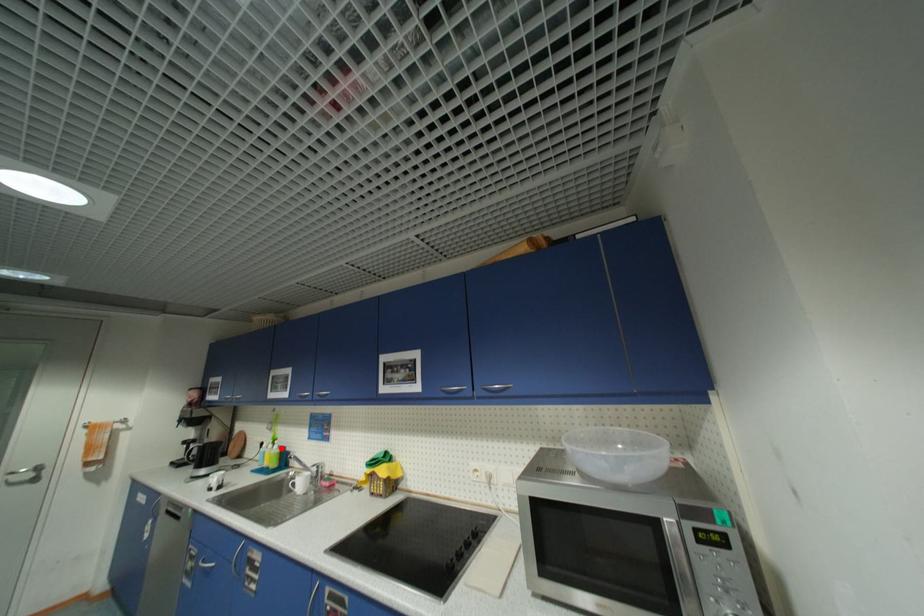
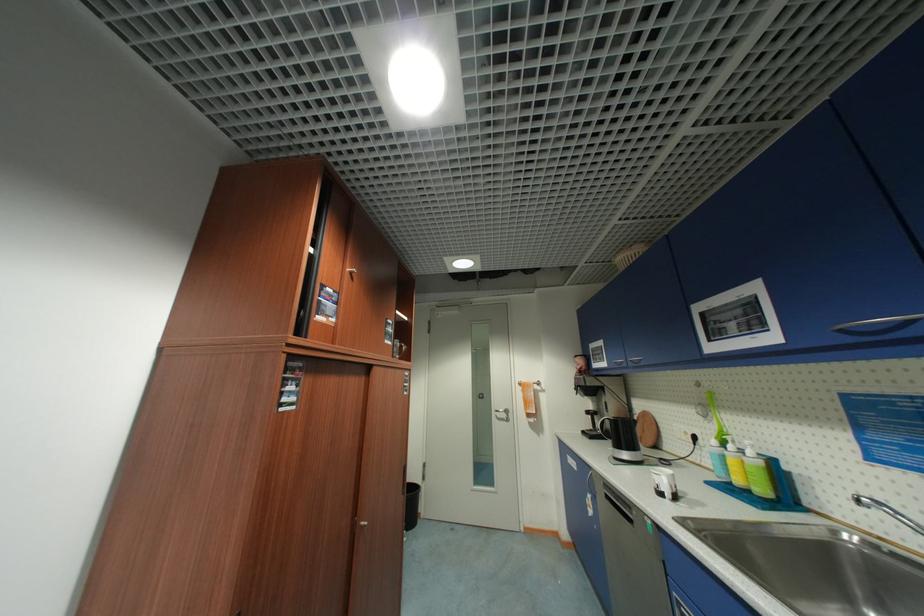
Find the pixel in the second image that matches the highlighted location in the first image.

(756, 454)